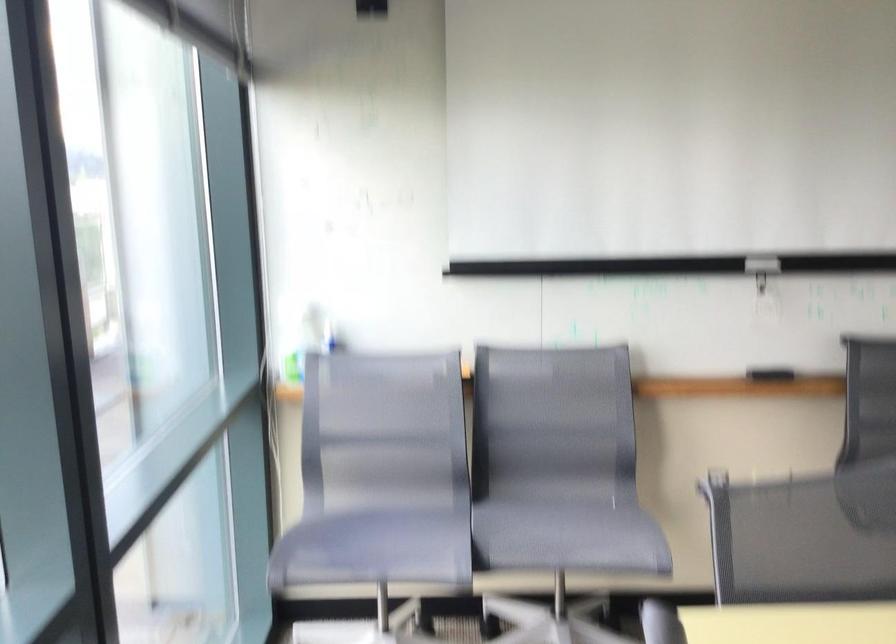
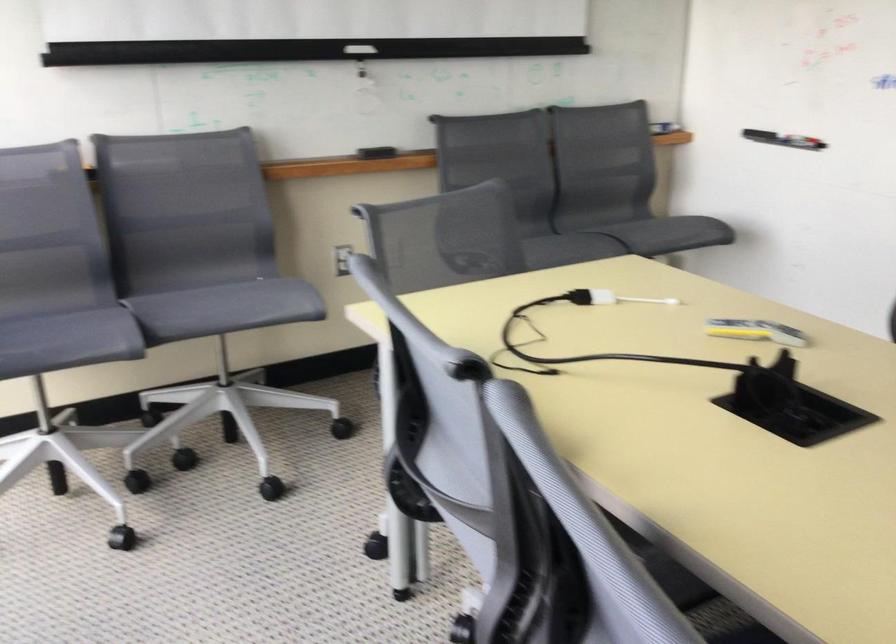
In the second image, find the point that corresponds to pixel 771 268 in the first image.

(359, 49)